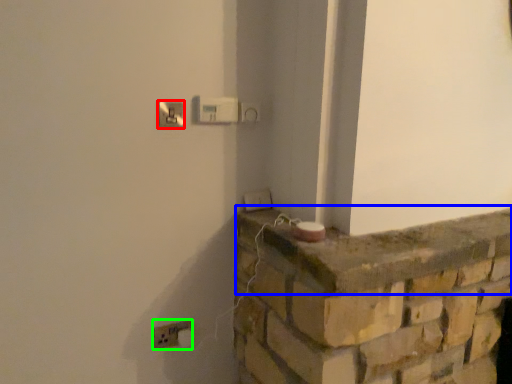
Question: Which is nearer to the light switch (highlighted by a red box)? ledge (highlighted by a blue box) or electric outlet (highlighted by a green box).

Choices:
 (A) ledge
 (B) electric outlet

Answer: (B)